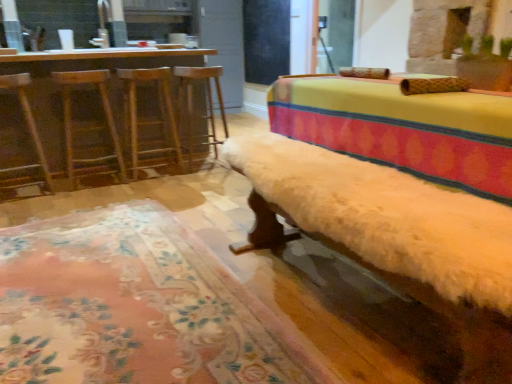
Question: From a real-world perspective, relative to wooden bar stool at center, which is the first bar stool from right to left, is wooden swivel chair at left, marked as the 2th swivel chair in a right-to-left arrangement, vertically above or below?

Choices:
 (A) below
 (B) above

Answer: (B)

Question: From the image's perspective, is wooden swivel chair at left, arranged as the 1th swivel chair when viewed from the left, positioned above or below wooden bar stool at center, which is the first bar stool from right to left?

Choices:
 (A) below
 (B) above

Answer: (A)

Question: Estimate the real-world distances between objects in this image. Which object is closer to the wooden bar stool at center, which is the first bar stool from right to left?

Choices:
 (A) wooden bar stool at left, placed as the 1th bar stool when sorted from left to right
 (B) wooden barstools at left
 (C) wooden swivel chair at left, the second swivel chair viewed from the left
 (D) fluffy beige rug at lower center
 (E) fuzzy white bench at center

Answer: (A)

Question: Which is farther from the fluffy beige rug at lower center?

Choices:
 (A) wooden swivel chair at left, marked as the 2th swivel chair in a right-to-left arrangement
 (B) fuzzy white bench at center
 (C) wooden barstools at left
 (D) wooden bar stool at center, the 2th bar stool from the left
 (E) wooden bar stool at left, placed as the 1th bar stool when sorted from left to right

Answer: (D)